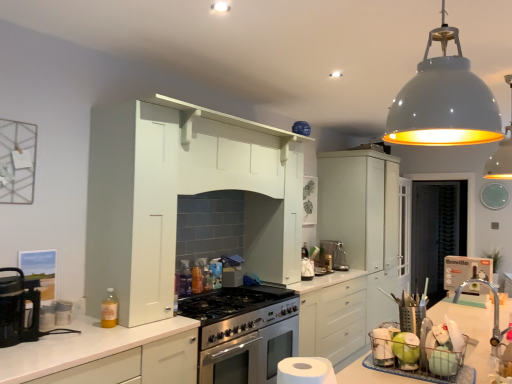
Question: Is white glossy pendant lamp at upper right, the 1th light fixture positioned from the front, situated inside white matte dome at upper center, which ranks as the 1th light fixture in back-to-front order, or outside?

Choices:
 (A) outside
 (B) inside

Answer: (A)

Question: Based on their sizes in the image, would you say white glossy pendant lamp at upper right, the 1th light fixture positioned from the front, is bigger or smaller than white matte dome at upper center, acting as the 2th light fixture starting from the front?

Choices:
 (A) small
 (B) big

Answer: (B)

Question: Which object is positioned closest to the matte white cabinet at center-right, which ranks as the first cabinetry in back-to-front order?

Choices:
 (A) satin silver kettle at center
 (B) white glossy pendant lamp at upper right, the 1th light fixture positioned from the front
 (C) white matte dome at upper center, which ranks as the 1th light fixture in back-to-front order
 (D) satin silver coffee machine at center
 (E) stainless steel oven at center

Answer: (D)

Question: Which is nearer to the black plastic coffee maker at left?

Choices:
 (A) satin silver kettle at center
 (B) matte white cabinet at center-right, which ranks as the first cabinetry in back-to-front order
 (C) translucent yellow bottle at lower left
 (D) white matte dome at upper center, which ranks as the 2th light fixture in left-to-right order
 (E) satin silver coffee machine at center

Answer: (C)